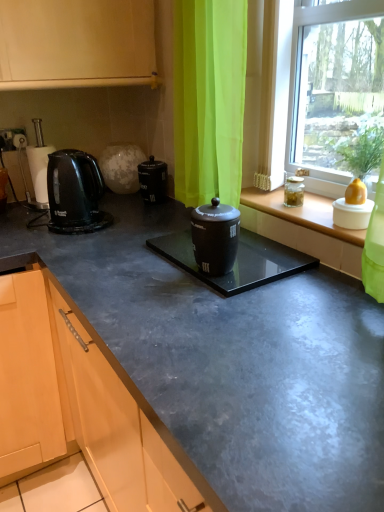
You are a GUI agent. You are given a task and a screenshot of the screen. Output one action in this format:
    pyautogui.click(x=<x>, y=<y>)
    Task: Click on the vacant region to the left of black glossy electric kettle at left
    
    Given the screenshot: What is the action you would take?
    (24, 226)